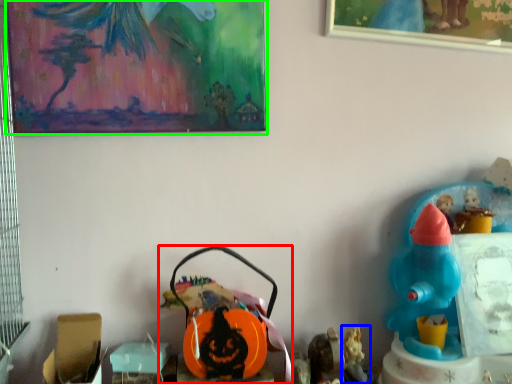
Question: Which is nearer to the toy (highlighted by a red box)? toy (highlighted by a blue box) or picture frame (highlighted by a green box).

Choices:
 (A) toy
 (B) picture frame

Answer: (A)